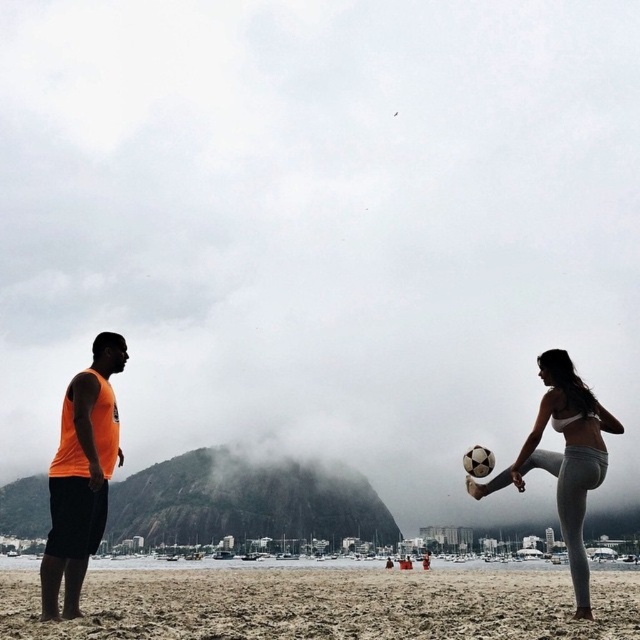
You are a photographer at the beach and want to capture both the orange sleeveless shirt at left and the white matte bikini at center in a single frame. Considering their heights, which object should you position closer to the camera to ensure both are fully visible in the photo?

The orange sleeveless shirt at left is much taller than the white matte bikini at center. To ensure both are fully visible, position the orange sleeveless shirt at left closer to the camera so its height doesn not block the white matte bikini at center.

You are a photographer trying to capture the exact position of the orange sleeveless shirt at left in the image. According to the coordinates provided, where would you focus your camera to ensure the shirt is centered in the frame?

The orange sleeveless shirt at left is located at coordinates point (81, 476), so you should focus your camera on that point to center it in the frame.

You are a photographer standing at the edge of the beach, aiming to capture a photo of the white matte bikini at center and the brown sand at lower center. If your camera can focus on objects within a 40 meter range, will both subjects be in focus?

The brown sand at lower center is 44.35 meters from the white matte bikini at center. Since the camera can only focus within 40 meters, the brown sand at lower center is beyond the focus range, so it won